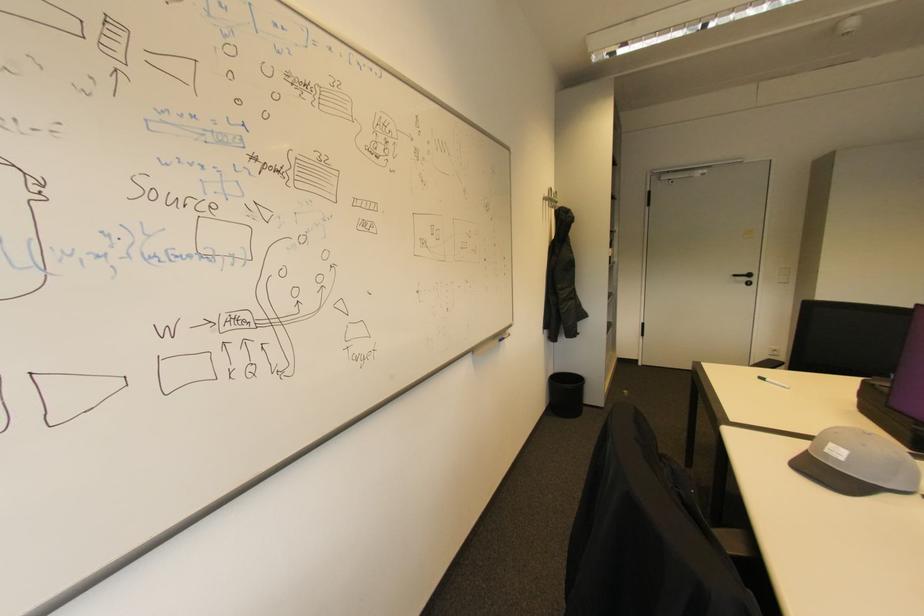
You are a GUI agent. You are given a task and a screenshot of the screen. Output one action in this format:
    pyautogui.click(x=<x>, y=<y>)
    Task: Click on the light switch
    The image size is (924, 616).
    Given the screenshot: What is the action you would take?
    pyautogui.click(x=784, y=275)